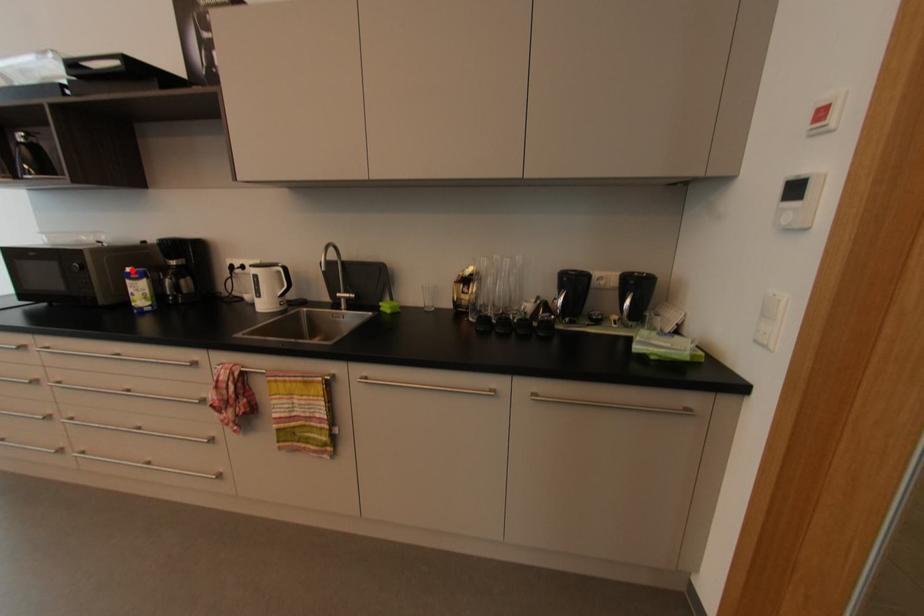
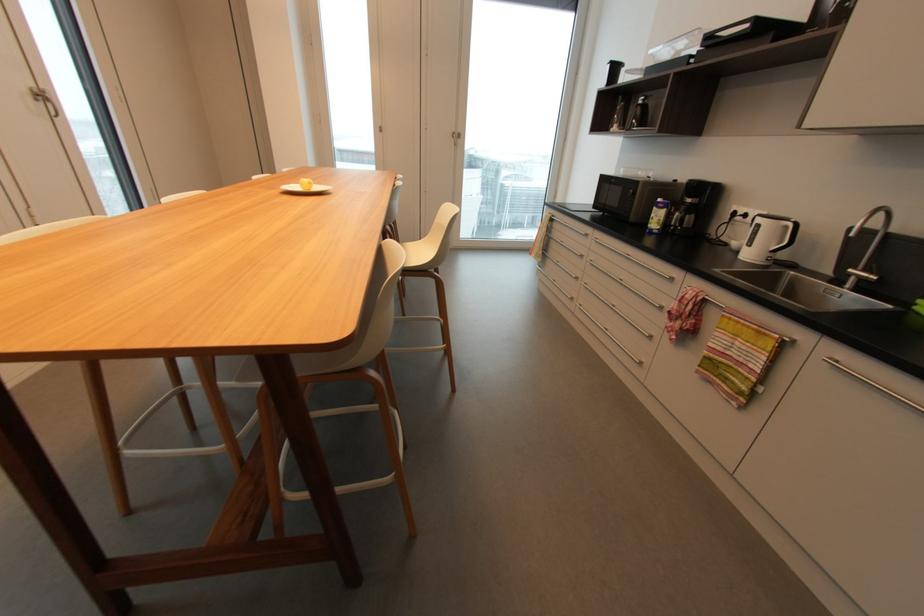
Locate, in the second image, the point that corresponds to the highlighted location in the first image.

(663, 200)